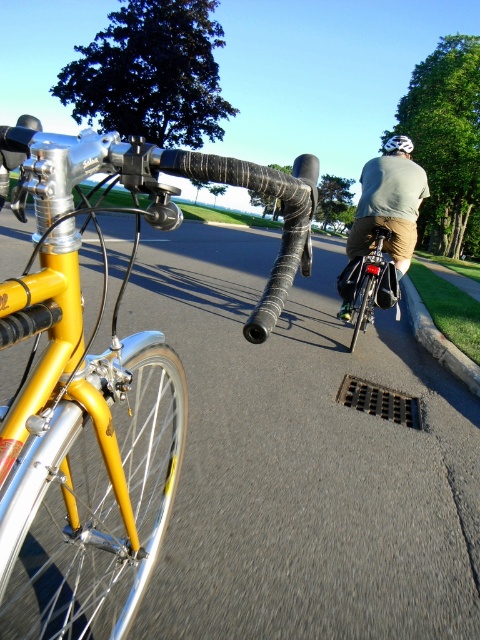
Question: Which object appears farthest from the camera in this image?

Choices:
 (A) yellow matte bicycle handlebars at center
 (B) matte black bicycle at center
 (C) white matte helmet at upper center

Answer: (C)

Question: From the image, what is the correct spatial relationship of light gray fabric shirt at center in relation to matte black bicycle at center?

Choices:
 (A) above
 (B) below

Answer: (A)

Question: Which is farther from the light gray fabric shirt at center?

Choices:
 (A) white matte helmet at upper center
 (B) yellow matte bicycle handlebars at center
 (C) matte black bicycle at center

Answer: (B)

Question: Which object is closer to the camera taking this photo?

Choices:
 (A) yellow matte bicycle handlebars at center
 (B) light gray fabric shirt at center
 (C) white matte helmet at upper center
 (D) matte black bicycle at center

Answer: (A)

Question: Can you confirm if yellow matte bicycle handlebars at center is thinner than matte black bicycle at center?

Choices:
 (A) no
 (B) yes

Answer: (A)

Question: Observing the image, what is the correct spatial positioning of light gray fabric shirt at center in reference to matte black bicycle at center?

Choices:
 (A) right
 (B) left

Answer: (A)